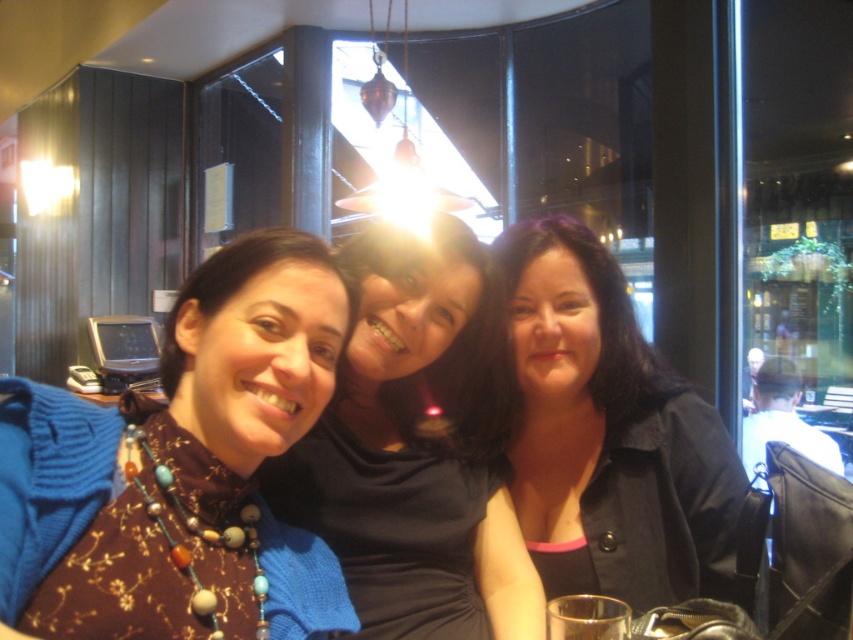
You are taking a photo of two points in the image. The first point is at coordinates point (225, 276) and the second is at point (538, 566). Which point will appear larger in your photo?

Point (225, 276) is closer to the camera than point (538, 566), so it will appear larger in the photo.